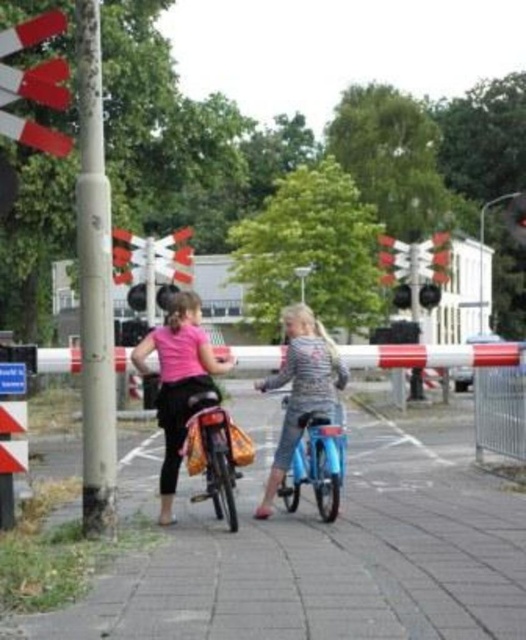
You are a delivery robot that needs to cross the brick pavement at center. The metallic red traffic light at upper right is in your way. Can you pass through the area between them?

The brick pavement at center is shorter than the metallic red traffic light at upper right, so the robot can pass through the area between them as there is enough vertical space.

You are a delivery robot approaching a railway crossing. You see a brick pavement at center and a matte black bicycle at center. Which object is closer to you?

The brick pavement at center is closer to the viewer than the matte black bicycle at center.